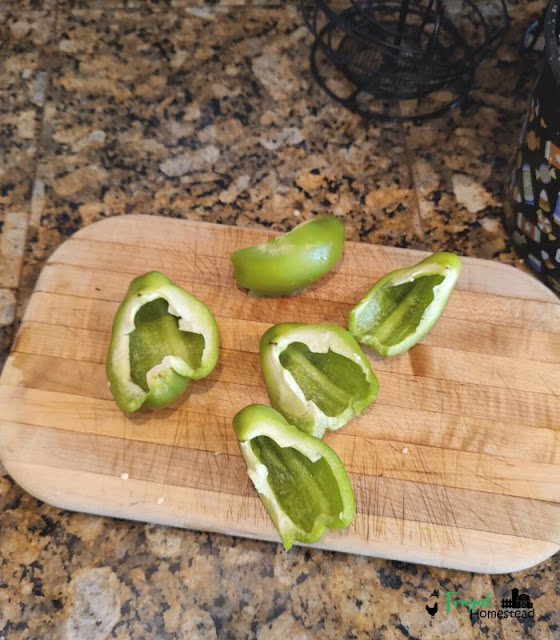
Where is `cutting board`? The image size is (560, 640). cutting board is located at coordinates (487, 361), (108, 450).